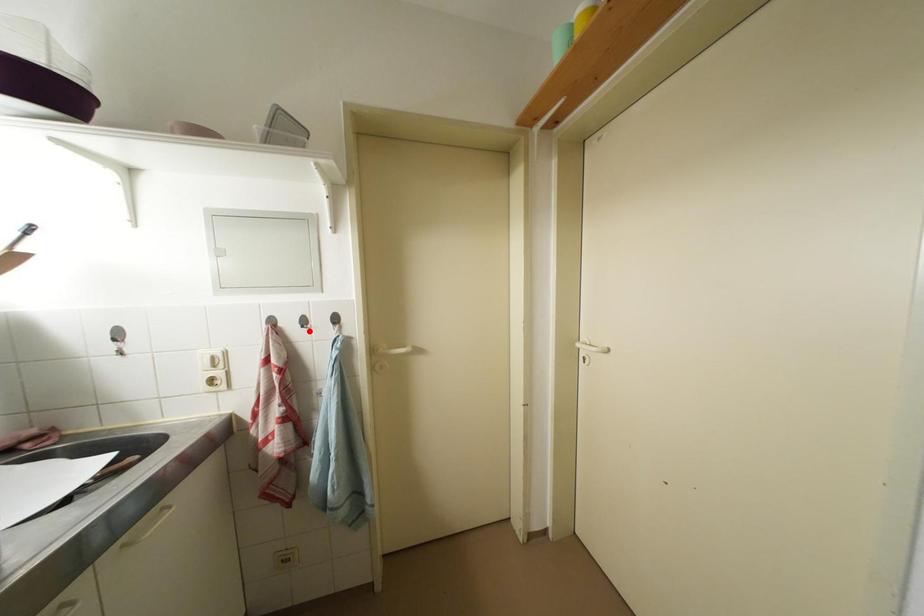
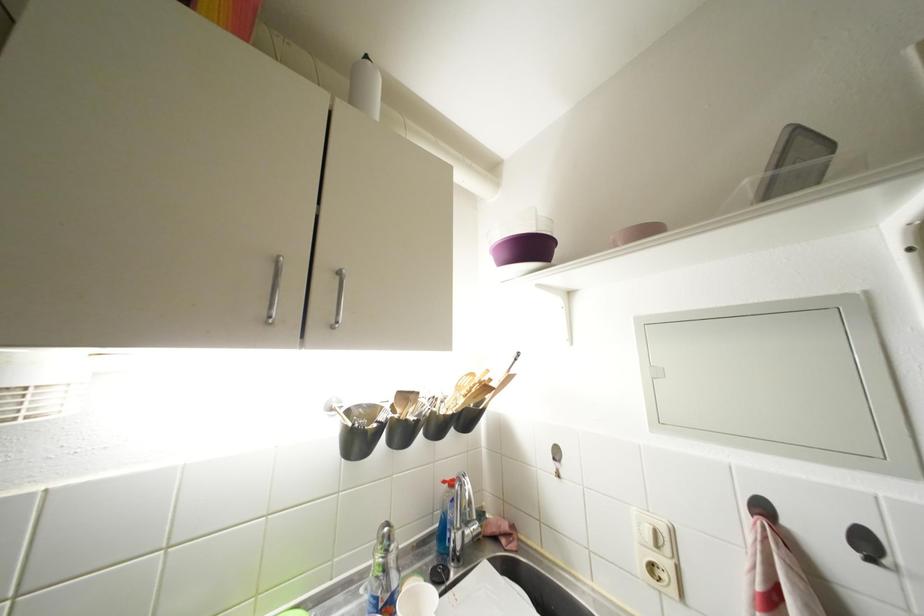
Locate, in the second image, the point that corresponds to the highlighted location in the first image.

(877, 565)